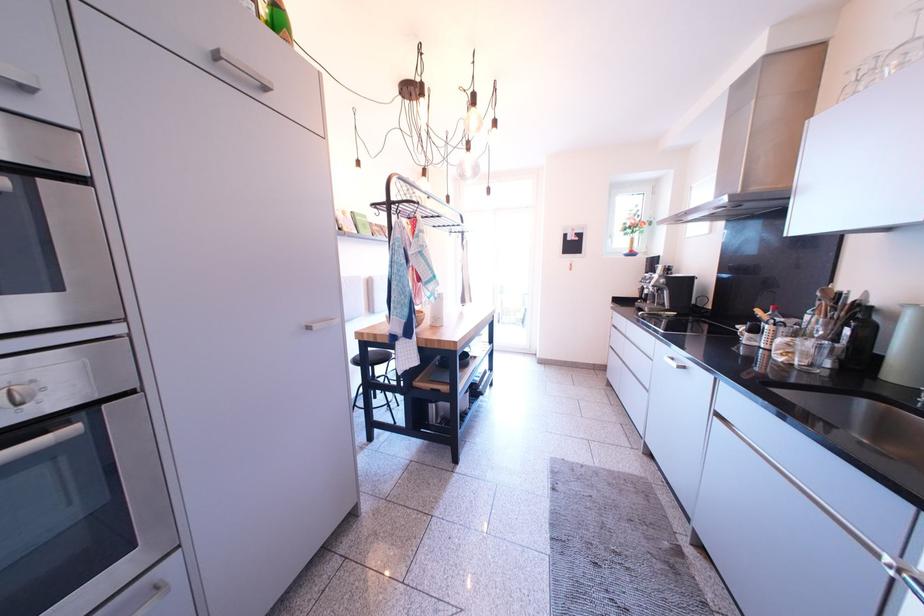
The width and height of the screenshot is (924, 616). Describe the element at coordinates (906, 349) in the screenshot. I see `the white kettle` at that location.